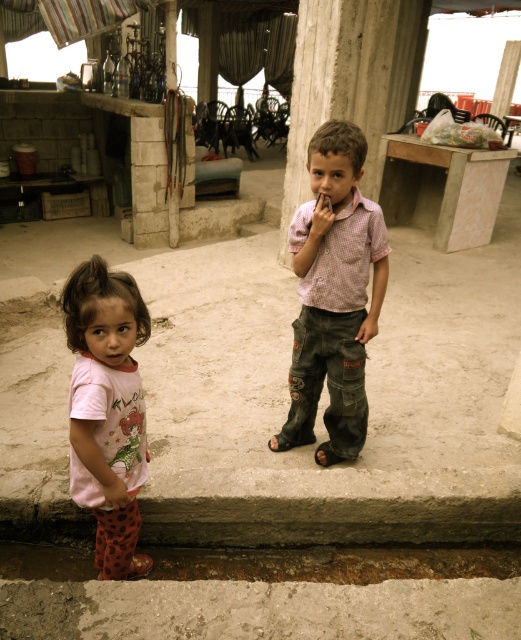
Question: Which of these objects is positioned farthest from the gray concrete curb at lower center?

Choices:
 (A) black leather sandal at lower center
 (B) checkered fabric shirt at center

Answer: (B)

Question: Does checkered fabric shirt at center appear over black leather sandal at lower center?

Choices:
 (A) yes
 (B) no

Answer: (A)

Question: Is checkered fabric shirt at center in front of gray concrete curb at lower center?

Choices:
 (A) no
 (B) yes

Answer: (B)

Question: Which object appears farthest from the camera in this image?

Choices:
 (A) pink cotton shirt at lower left
 (B) checkered fabric shirt at center

Answer: (B)

Question: Does gray concrete curb at lower center have a smaller size compared to black leather sandal at lower center?

Choices:
 (A) no
 (B) yes

Answer: (A)

Question: Based on their relative distances, which object is farther from the pink cotton shirt at lower left?

Choices:
 (A) black leather sandal at lower center
 (B) checkered fabric shirt at center

Answer: (A)